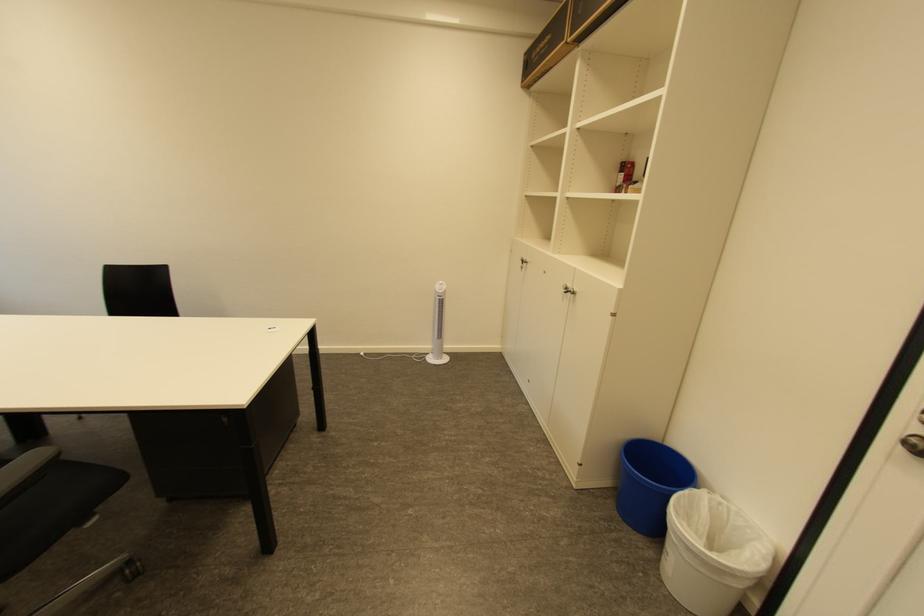
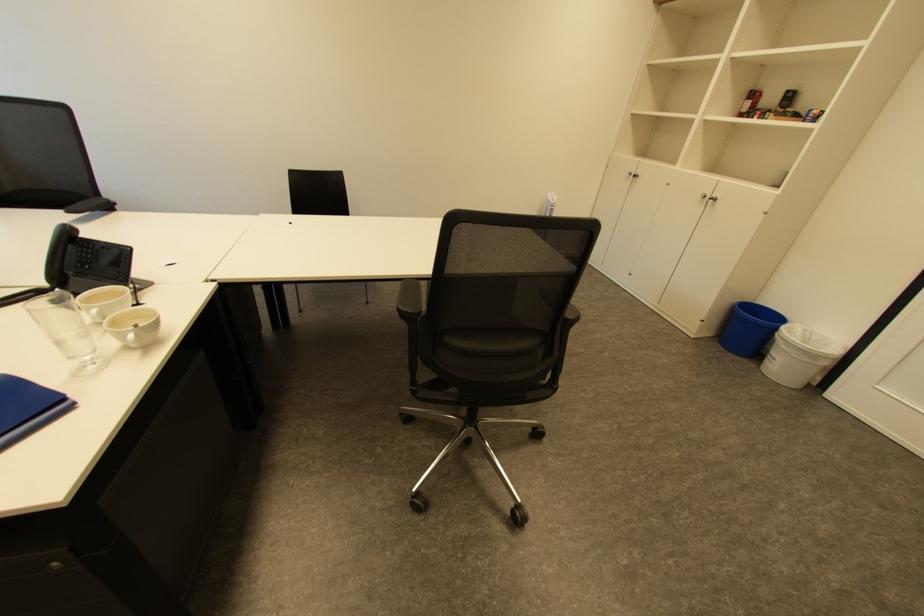
The point at (623, 507) is marked in the first image. Where is the corresponding point in the second image?

(728, 346)